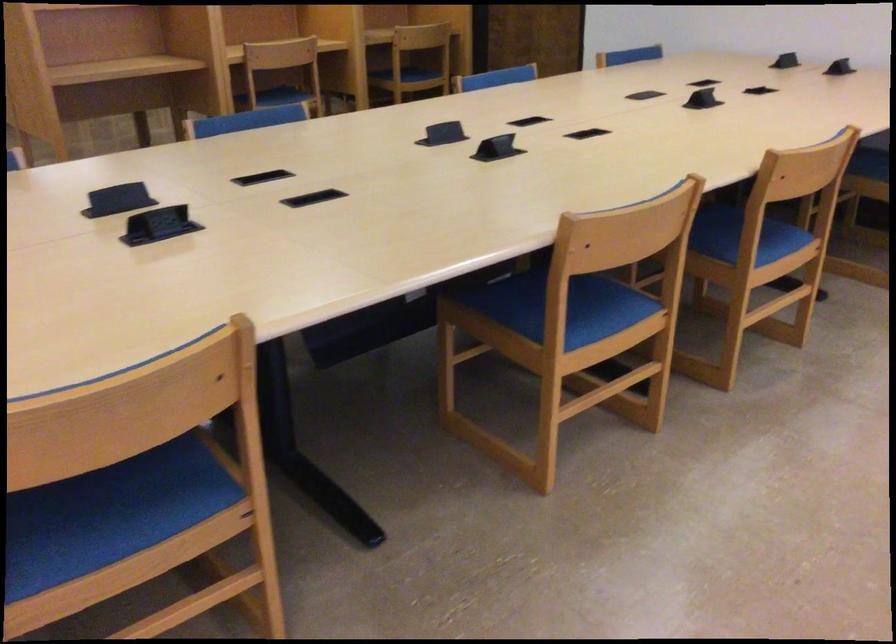
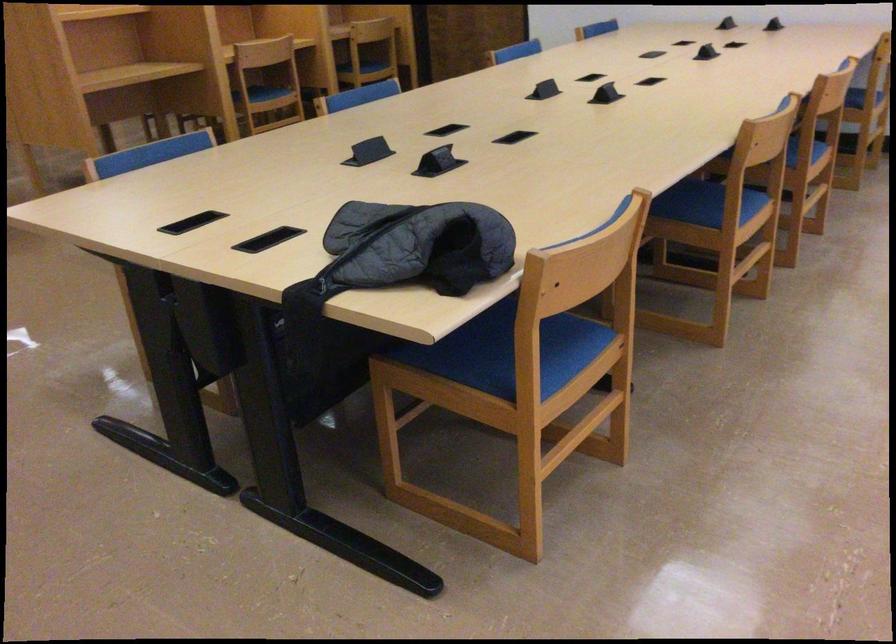
Locate, in the second image, the point that corresponds to (739,274) in the first image.

(805, 171)